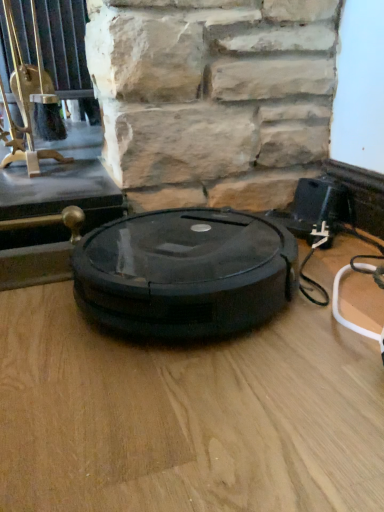
What do you see at coordinates (31, 98) in the screenshot? I see `brushed metal fireplace tool at upper left` at bounding box center [31, 98].

Where is `brushed metal fireplace tool at upper left`? brushed metal fireplace tool at upper left is located at coordinates (31, 98).

This screenshot has width=384, height=512. Describe the element at coordinates (185, 272) in the screenshot. I see `black plastic robot vacuum cleaner at center` at that location.

Locate an element on the screen. This screenshot has height=512, width=384. black plastic robot vacuum cleaner at center is located at coordinates (185, 272).

In order to face black plastic robot vacuum cleaner at center, should I rotate leftwards or rightwards?

It's best to rotate left around 1.573 degrees.

Measure the distance between black plastic robot vacuum cleaner at center and camera.

A distance of 19.74 inches exists between black plastic robot vacuum cleaner at center and camera.

Locate an element on the screen. The image size is (384, 512). brushed metal fireplace tool at upper left is located at coordinates (31, 98).

Is black plastic robot vacuum cleaner at center to the right of brushed metal fireplace tool at upper left from the viewer's perspective?

Indeed, black plastic robot vacuum cleaner at center is positioned on the right side of brushed metal fireplace tool at upper left.

Considering their positions, is black plastic robot vacuum cleaner at center located in front of or behind brushed metal fireplace tool at upper left?

Visually, black plastic robot vacuum cleaner at center is located in front of brushed metal fireplace tool at upper left.

Is point (181, 234) less distant than point (20, 145)?

Yes, point (181, 234) is in front of point (20, 145).

From the image's perspective, does black plastic robot vacuum cleaner at center appear lower than brushed metal fireplace tool at upper left?

Indeed, from the image's perspective, black plastic robot vacuum cleaner at center is shown beneath brushed metal fireplace tool at upper left.

From a real-world perspective, which is physically below, black plastic robot vacuum cleaner at center or brushed metal fireplace tool at upper left?

From a 3D spatial view, black plastic robot vacuum cleaner at center is below.

Can you confirm if black plastic robot vacuum cleaner at center is wider than brushed metal fireplace tool at upper left?

Yes, black plastic robot vacuum cleaner at center is wider than brushed metal fireplace tool at upper left.

Considering the sizes of objects black plastic robot vacuum cleaner at center and brushed metal fireplace tool at upper left in the image provided, who is taller, black plastic robot vacuum cleaner at center or brushed metal fireplace tool at upper left?

brushed metal fireplace tool at upper left is taller.

Is black plastic robot vacuum cleaner at center bigger or smaller than brushed metal fireplace tool at upper left?

Considering their sizes, black plastic robot vacuum cleaner at center takes up less space than brushed metal fireplace tool at upper left.

Choose the correct answer: Is black plastic robot vacuum cleaner at center inside brushed metal fireplace tool at upper left or outside it?

black plastic robot vacuum cleaner at center is located beyond the bounds of brushed metal fireplace tool at upper left.

Are black plastic robot vacuum cleaner at center and brushed metal fireplace tool at upper left far apart?

That's not correct — black plastic robot vacuum cleaner at center is a little close to brushed metal fireplace tool at upper left.

Is black plastic robot vacuum cleaner at center positioned with its back to brushed metal fireplace tool at upper left?

That's not correct — black plastic robot vacuum cleaner at center is not looking away from brushed metal fireplace tool at upper left.

In the image, there is a brushed metal fireplace tool at upper left. Find the location of `weight scale below it (from the image's perspective)`. weight scale below it (from the image's perspective) is located at coordinates (185, 272).

Considering the relative positions of brushed metal fireplace tool at upper left and black plastic robot vacuum cleaner at center in the image provided, is brushed metal fireplace tool at upper left to the left or to the right of black plastic robot vacuum cleaner at center?

brushed metal fireplace tool at upper left is to the left of black plastic robot vacuum cleaner at center.

Is brushed metal fireplace tool at upper left positioned in front of black plastic robot vacuum cleaner at center?

That is False.

Is point (41, 50) positioned in front of point (212, 321)?

No, it is behind (212, 321).

From the image's perspective, is brushed metal fireplace tool at upper left positioned above or below black plastic robot vacuum cleaner at center?

Based on their image positions, brushed metal fireplace tool at upper left is located above black plastic robot vacuum cleaner at center.

From a real-world perspective, is brushed metal fireplace tool at upper left positioned over black plastic robot vacuum cleaner at center based on gravity?

Yes.

Does brushed metal fireplace tool at upper left have a lesser width compared to black plastic robot vacuum cleaner at center?

Correct, the width of brushed metal fireplace tool at upper left is less than that of black plastic robot vacuum cleaner at center.

Who is taller, brushed metal fireplace tool at upper left or black plastic robot vacuum cleaner at center?

With more height is brushed metal fireplace tool at upper left.

Does brushed metal fireplace tool at upper left have a larger size compared to black plastic robot vacuum cleaner at center?

Indeed, brushed metal fireplace tool at upper left has a larger size compared to black plastic robot vacuum cleaner at center.

Do you think brushed metal fireplace tool at upper left is within black plastic robot vacuum cleaner at center, or outside of it?

The correct answer is: outside.

Is there a large distance between brushed metal fireplace tool at upper left and black plastic robot vacuum cleaner at center?

Actually, brushed metal fireplace tool at upper left and black plastic robot vacuum cleaner at center are a little close together.

Is brushed metal fireplace tool at upper left turned away from black plastic robot vacuum cleaner at center?

brushed metal fireplace tool at upper left does not have its back to black plastic robot vacuum cleaner at center.

How many degrees apart are the facing directions of brushed metal fireplace tool at upper left and black plastic robot vacuum cleaner at center?

The angular difference between brushed metal fireplace tool at upper left and black plastic robot vacuum cleaner at center is 2.1 degrees.

How distant is brushed metal fireplace tool at upper left from black plastic robot vacuum cleaner at center?

brushed metal fireplace tool at upper left is 21.93 inches from black plastic robot vacuum cleaner at center.

Identify the location of window on the left of black plastic robot vacuum cleaner at center. (31, 98).

In order to click on weight scale below the brushed metal fireplace tool at upper left (from a real-world perspective) in this screenshot , I will do (185, 272).

Where is `weight scale below the brushed metal fireplace tool at upper left (from the image's perspective)`? weight scale below the brushed metal fireplace tool at upper left (from the image's perspective) is located at coordinates (185, 272).